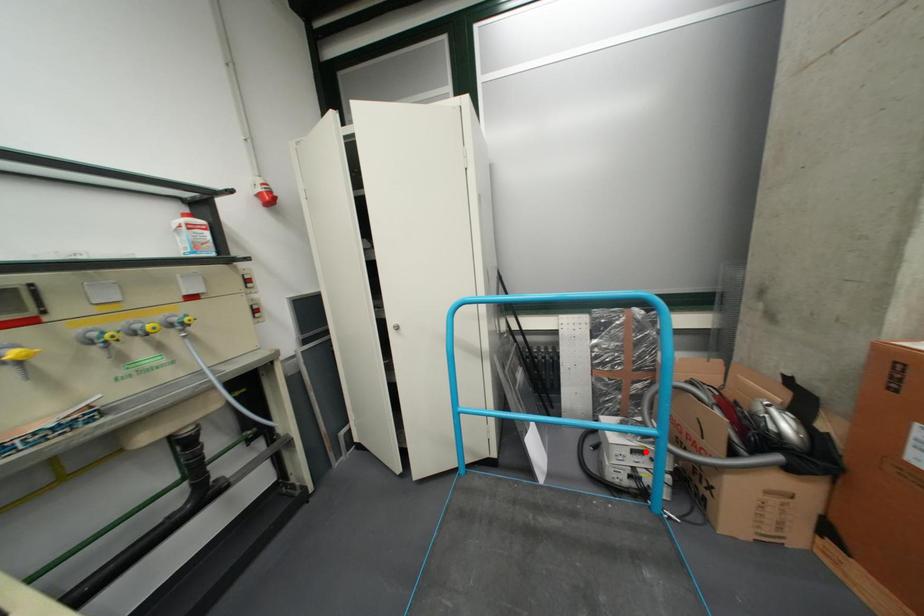
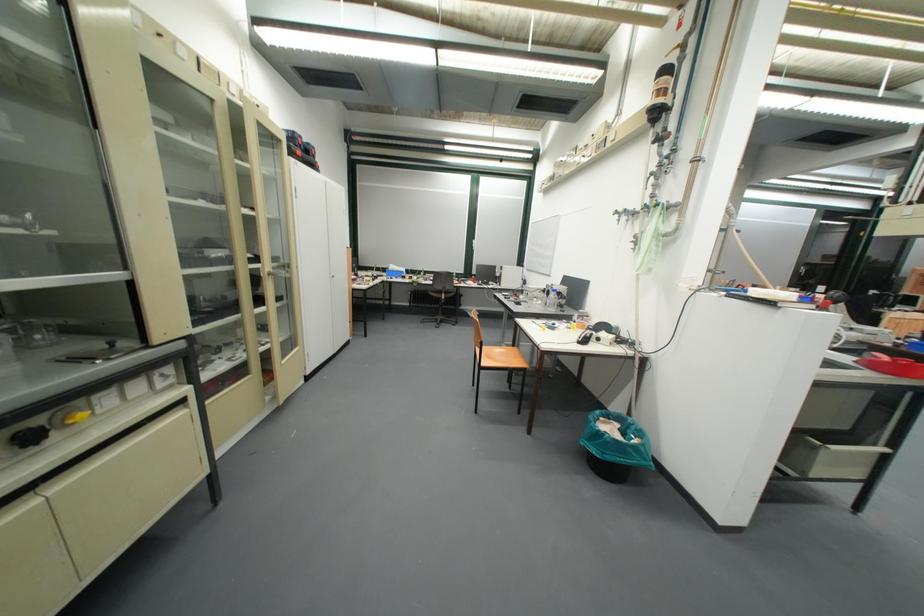
Question: I am providing you with two images of the same scene from different viewpoints. A red point is marked on the first image. At the location where the point appears in image 1, is it still visible in image 2?

Choices:
 (A) Yes
 (B) No

Answer: (B)